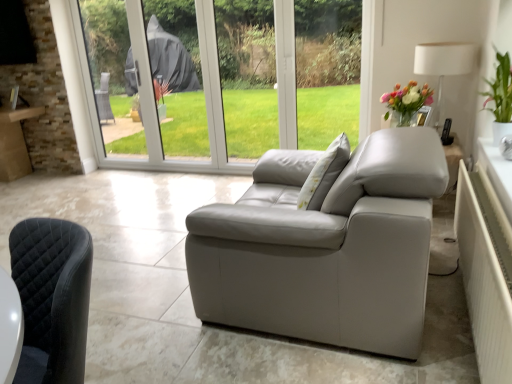
Question: Does point (492, 379) appear closer or farther from the camera than point (424, 56)?

Choices:
 (A) closer
 (B) farther

Answer: (A)

Question: Looking at the image, does white textured radiator at right seem bigger or smaller compared to white fabric lampshade at upper right?

Choices:
 (A) big
 (B) small

Answer: (A)

Question: Which object is positioned closest to the white fabric lampshade at upper right?

Choices:
 (A) green leafy plant at upper right
 (B) white textured radiator at right

Answer: (A)

Question: Based on their relative distances, which object is farther from the white textured radiator at right?

Choices:
 (A) white fabric lampshade at upper right
 (B) green leafy plant at upper right

Answer: (A)